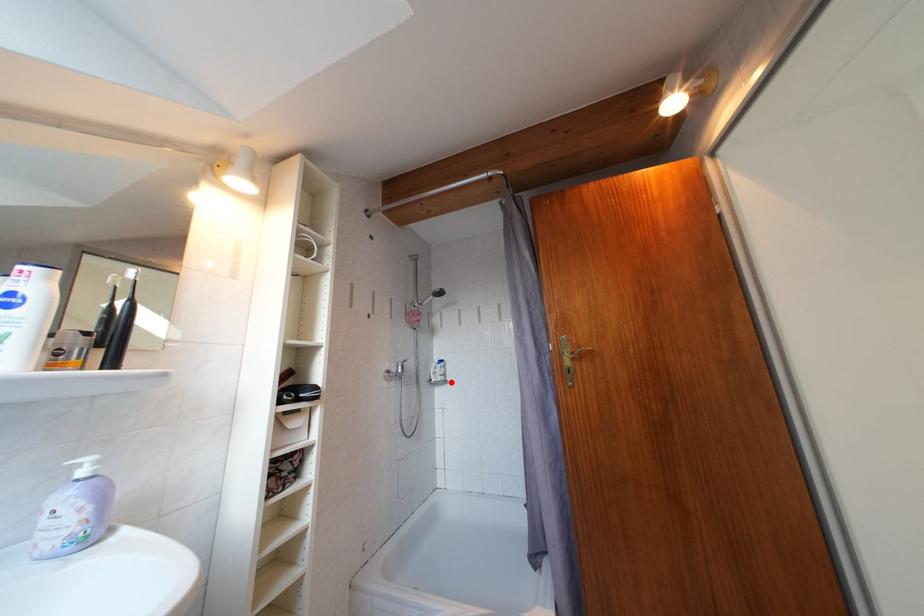
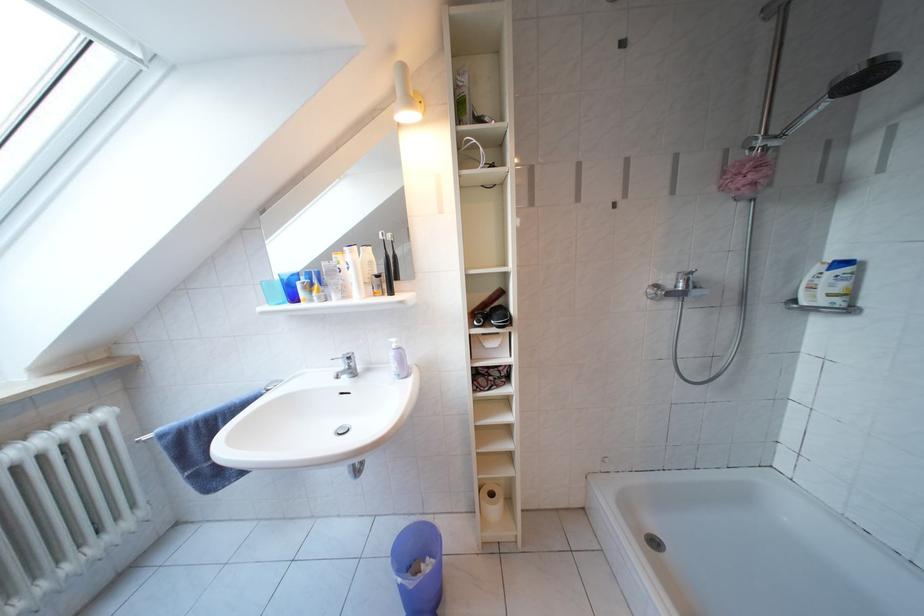
Question: A red point is marked in image1. In image2, is the corresponding 3D point closer to the camera or farther? Reply with the corresponding letter.

Choices:
 (A) The corresponding 3D point is closer.
 (B) The corresponding 3D point is farther.

Answer: (A)